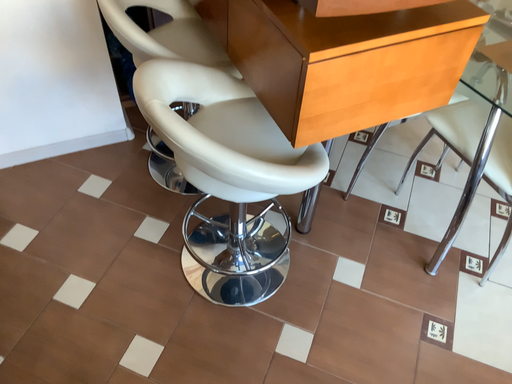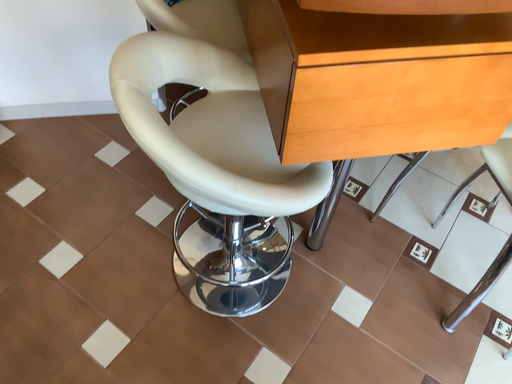
Question: Which way did the camera rotate in the video?

Choices:
 (A) rotated right
 (B) rotated left

Answer: (B)